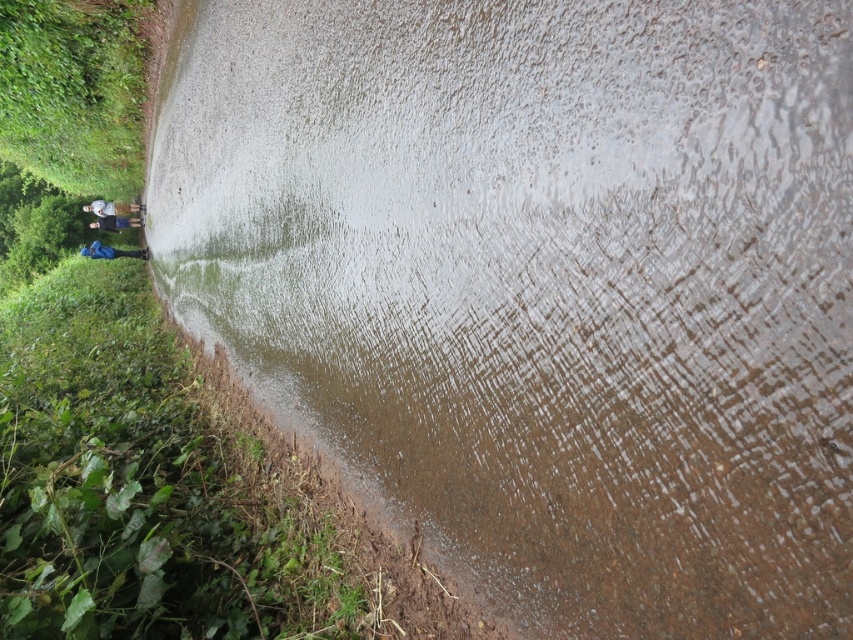
You are a delivery person carrying a blue fabric backpack at left and wearing blue fabric pants at left. You need to walk along the wet gravel path. Can you step between the backpack and your pants without stepping into the water pooling on the path edges?

The blue fabric backpack at left and blue fabric pants at left are 6.32 feet apart from each other. Since the path is wide enough to accommodate this distance, you can step between them without entering the water on the edges.

Based on the photo, you are a hiker wearing the blue fabric pants at left and carrying the blue fabric backpack at left. You want to cross the wet gravelly path. Considering the height difference between your pants and backpack, which item is more likely to get wet from the water pooling along the path edges?

The blue fabric backpack at left is more likely to get wet because it has a smaller height compared to the blue fabric pants at left, making it closer to the water pooling on the path edges.